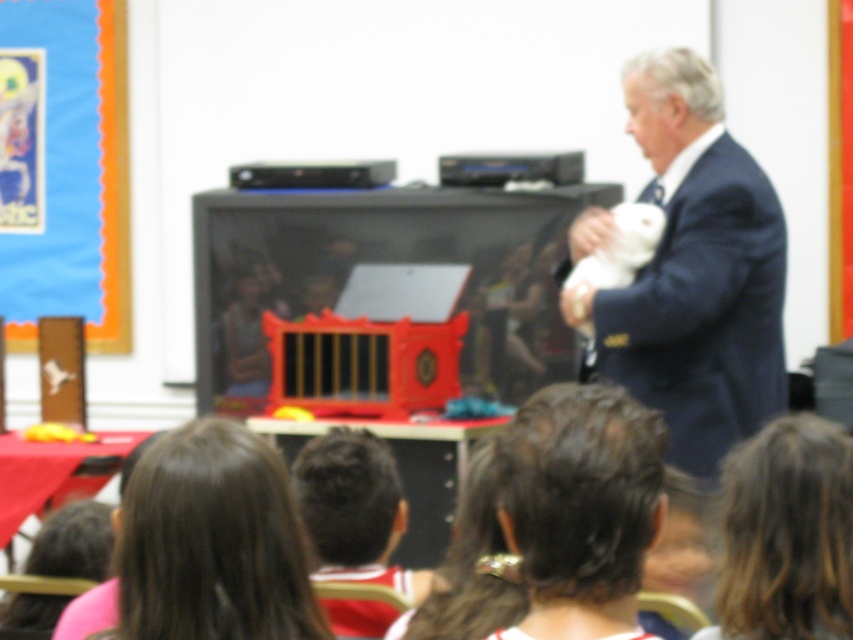
Is point (724, 209) in front of point (434, 605)?

No, it is not.

In the scene shown: Who is lower down, dark blue suit at right or dark brown hair at center?

dark brown hair at center is below.

Identify the location of dark blue suit at right. (695, 272).

At what (x,y) coordinates should I click in order to perform the action: click on dark blue suit at right. Please return your answer as a coordinate pair (x, y). The height and width of the screenshot is (640, 853). Looking at the image, I should click on (695, 272).

Can you confirm if dark blue suit at right is smaller than brown hair at lower right?

Actually, dark blue suit at right might be larger than brown hair at lower right.

Can you confirm if dark blue suit at right is bigger than brown hair at lower right?

Yes.

The image size is (853, 640). What are the coordinates of `dark blue suit at right` in the screenshot? It's located at (695, 272).

Who is more forward, (x=554, y=586) or (x=247, y=536)?

Point (x=554, y=586)

Does dark brown hair at center have a lesser width compared to brown hair at lower left?

In fact, dark brown hair at center might be wider than brown hair at lower left.

Describe the element at coordinates (555, 509) in the screenshot. I see `dark brown hair at center` at that location.

Where is `dark brown hair at center`? dark brown hair at center is located at coordinates (555, 509).